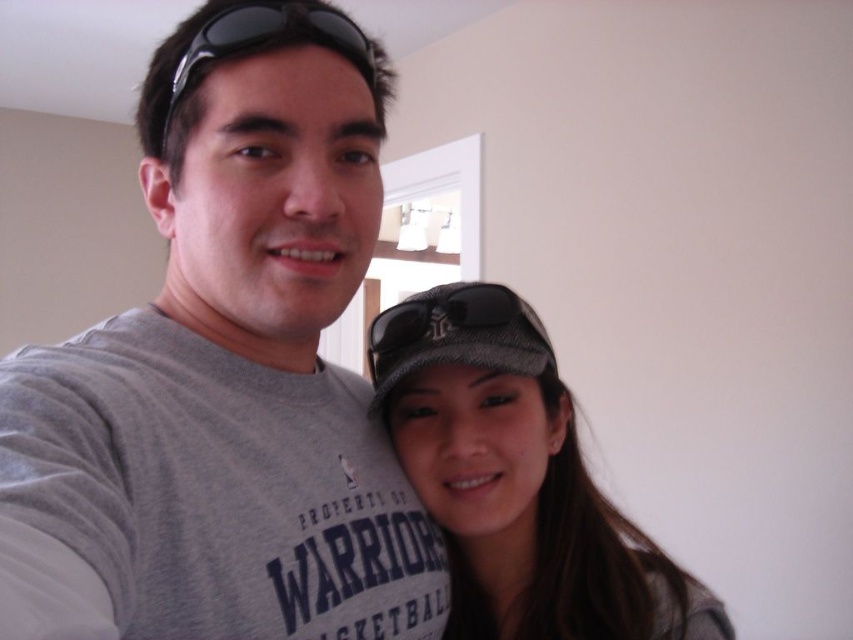
From the picture: You are a photographer trying to frame a shot focusing on the gray mesh baseball cap at lower right and the black plastic sunglasses at upper center. Which object should you zoom in on to capture more details without moving the camera, considering their sizes?

The gray mesh baseball cap at lower right is taller than the black plastic sunglasses at upper center, so you should zoom in on the gray mesh baseball cap at lower right to capture more details since it is larger.